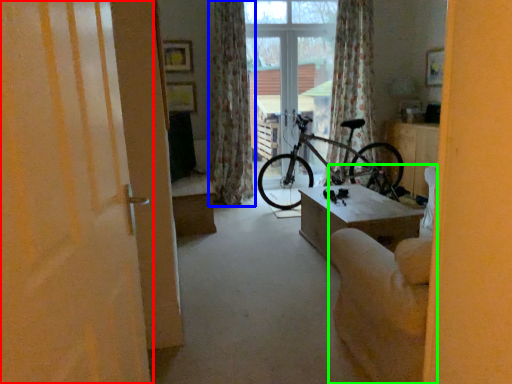
Question: Considering the real-world distances, which object is closest to door (highlighted by a red box)? curtain (highlighted by a blue box) or armchair (highlighted by a green box).

Choices:
 (A) curtain
 (B) armchair

Answer: (B)